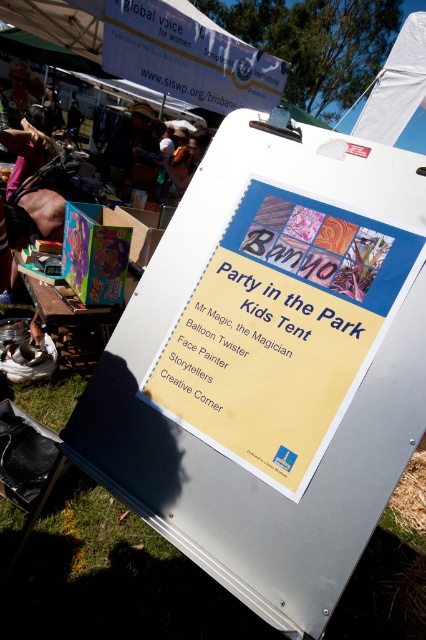
Question: Is yellow paper sign at center wider than white paper sign at upper center?

Choices:
 (A) no
 (B) yes

Answer: (A)

Question: Among these objects, which one is farthest from the camera?

Choices:
 (A) white paper sign at upper center
 (B) yellow paper sign at center

Answer: (A)

Question: Among these objects, which one is nearest to the camera?

Choices:
 (A) white paper sign at upper center
 (B) yellow paper sign at center

Answer: (B)

Question: Is yellow paper sign at center in front of white paper sign at upper center?

Choices:
 (A) yes
 (B) no

Answer: (A)

Question: In this image, where is yellow paper sign at center located relative to white paper sign at upper center?

Choices:
 (A) left
 (B) right

Answer: (B)

Question: Which point is closer to the camera?

Choices:
 (A) white paper sign at upper center
 (B) yellow paper sign at center

Answer: (B)